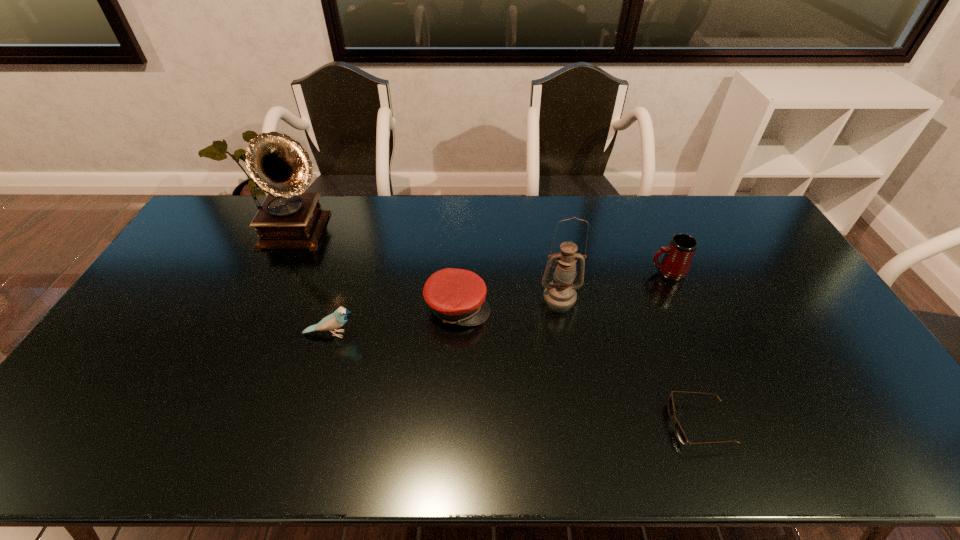
Locate an element on the screen. This screenshot has height=540, width=960. the leftmost object is located at coordinates (287, 219).

Find the location of a particular element. The height and width of the screenshot is (540, 960). record player is located at coordinates 287,219.

You are a GUI agent. You are given a task and a screenshot of the screen. Output one action in this format:
    pyautogui.click(x=<x>, y=<y>)
    Task: Click on the fifth shortest object
    
    Given the screenshot: What is the action you would take?
    pyautogui.click(x=560, y=292)

Locate an element on the screen. This screenshot has height=540, width=960. oil lamp is located at coordinates (560, 292).

The width and height of the screenshot is (960, 540). I want to click on mug, so click(675, 264).

Identify the location of the fifth object from right to left. This screenshot has width=960, height=540. [337, 319].

Image resolution: width=960 pixels, height=540 pixels. Identify the location of the third object from left to right. (457, 296).

In order to click on the fifth tallest object in this screenshot , I will do `click(457, 296)`.

Locate an element on the screen. The width and height of the screenshot is (960, 540). the nearest object is located at coordinates (679, 432).

The height and width of the screenshot is (540, 960). In order to click on the shortest object in this screenshot , I will do `click(679, 432)`.